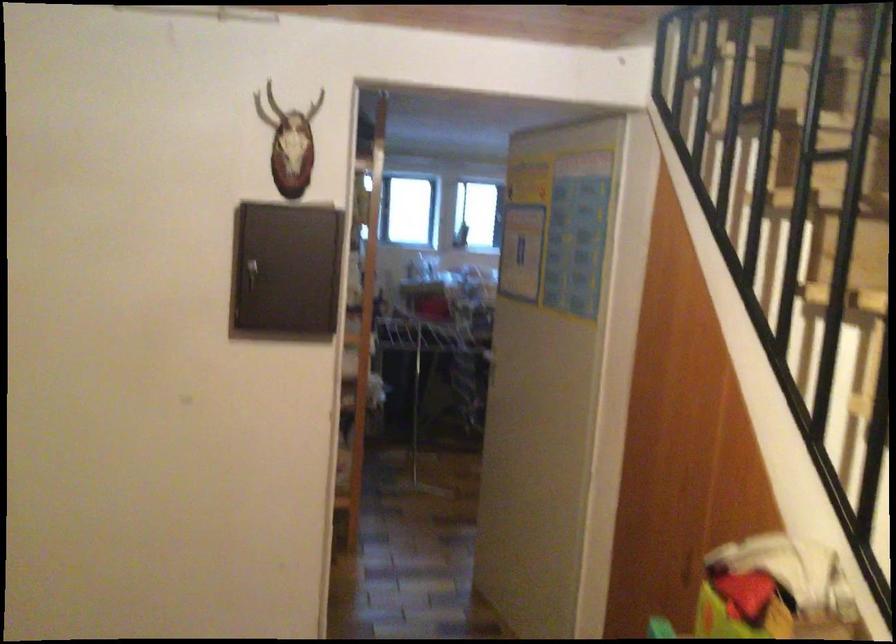
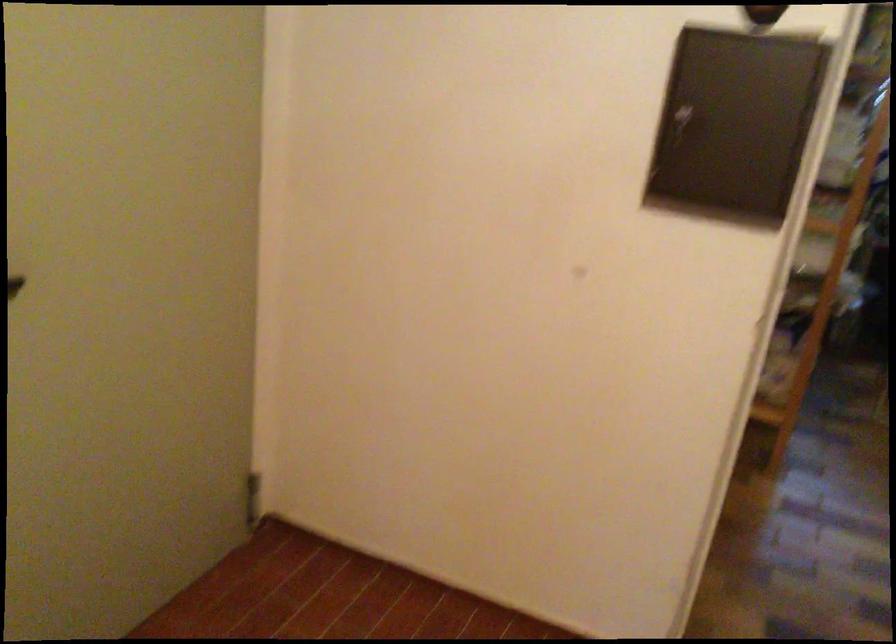
Find the pixel in the second image that matches (291,272) in the first image.

(734, 122)